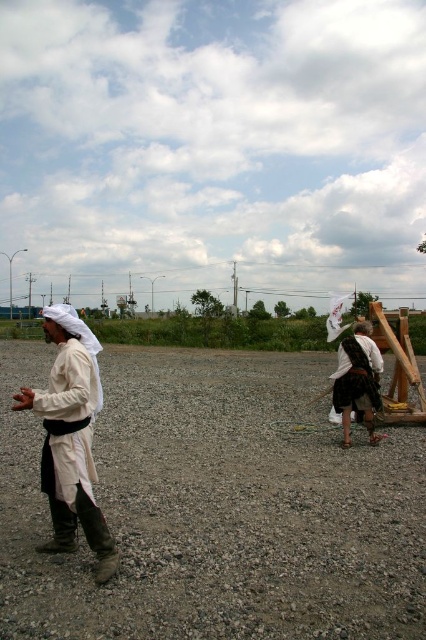
Question: Is white cotton robe at left closer to camera compared to white cotton robe at right?

Choices:
 (A) yes
 (B) no

Answer: (A)

Question: Considering the real-world distances, which object is farthest from the white cotton robe at right?

Choices:
 (A) white cotton robe at left
 (B) gray gravel at center

Answer: (A)

Question: Is gray gravel at center positioned in front of white cotton robe at right?

Choices:
 (A) yes
 (B) no

Answer: (A)

Question: Estimate the real-world distances between objects in this image. Which object is farther from the white cotton robe at right?

Choices:
 (A) white cotton robe at left
 (B) gray gravel at center

Answer: (A)

Question: Is gray gravel at center to the right of white cotton robe at left from the viewer's perspective?

Choices:
 (A) yes
 (B) no

Answer: (A)

Question: Which point is farther to the camera?

Choices:
 (A) white cotton robe at left
 (B) gray gravel at center
 (C) white cotton robe at right

Answer: (C)